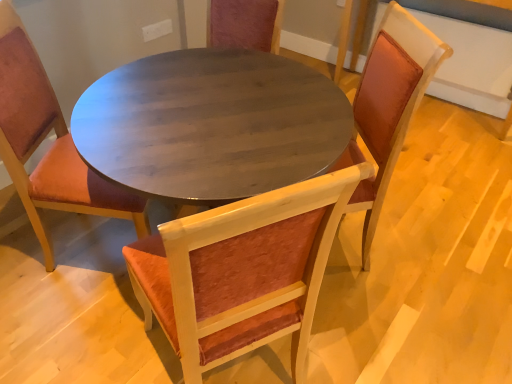
Question: Can you confirm if velvet orange chair at center, placed as the 3th chair when sorted from right to left, is thinner than velvet orange chair at center, which is counted as the 3th chair, starting from the left?

Choices:
 (A) no
 (B) yes

Answer: (B)

Question: Can velvet orange chair at center, which ranks as the first chair in right-to-left order, be found inside velvet orange chair at center, placed as the 3th chair when sorted from right to left?

Choices:
 (A) no
 (B) yes

Answer: (A)

Question: Is velvet orange chair at center, which ranks as the first chair in left-to-right order, oriented away from velvet orange chair at center, which is counted as the 3th chair, starting from the left?

Choices:
 (A) no
 (B) yes

Answer: (A)

Question: Considering the relative positions of velvet orange chair at center, which ranks as the first chair in left-to-right order, and velvet orange chair at center, which is counted as the 3th chair, starting from the left, in the image provided, is velvet orange chair at center, which ranks as the first chair in left-to-right order, to the left of velvet orange chair at center, which is counted as the 3th chair, starting from the left, from the viewer's perspective?

Choices:
 (A) no
 (B) yes

Answer: (B)

Question: Is the depth of velvet orange chair at center, placed as the 3th chair when sorted from right to left, greater than that of velvet orange chair at center, which is counted as the 3th chair, starting from the left?

Choices:
 (A) no
 (B) yes

Answer: (B)

Question: Is velvet orange chair at center, which ranks as the first chair in left-to-right order, facing towards velvet orange chair at center, which ranks as the first chair in right-to-left order?

Choices:
 (A) no
 (B) yes

Answer: (B)

Question: From a real-world perspective, is velvet orange chair at center, which ranks as the first chair in right-to-left order, positioned over velvet orange chair at center, the 2th chair viewed from the right, based on gravity?

Choices:
 (A) no
 (B) yes

Answer: (B)

Question: Would you say velvet orange chair at center, which ranks as the first chair in right-to-left order, contains velvet orange chair at center, the 2th chair viewed from the right?

Choices:
 (A) no
 (B) yes

Answer: (A)

Question: Is velvet orange chair at center, which ranks as the first chair in right-to-left order, placed right next to velvet orange chair at center, the 2th chair viewed from the right?

Choices:
 (A) yes
 (B) no

Answer: (B)

Question: Is velvet orange chair at center, which is counted as the 3th chair, starting from the left, positioned beyond the bounds of velvet orange chair at center, which is the second chair from left to right?

Choices:
 (A) yes
 (B) no

Answer: (A)

Question: Is velvet orange chair at center, which ranks as the first chair in right-to-left order, bigger than velvet orange chair at center, which is the second chair from left to right?

Choices:
 (A) no
 (B) yes

Answer: (B)

Question: Considering the relative sizes of velvet orange chair at center, which is counted as the 3th chair, starting from the left, and velvet orange chair at center, the 2th chair viewed from the right, in the image provided, is velvet orange chair at center, which is counted as the 3th chair, starting from the left, taller than velvet orange chair at center, the 2th chair viewed from the right,?

Choices:
 (A) no
 (B) yes

Answer: (B)

Question: Is there a large distance between velvet orange chair at center, placed as the 3th chair when sorted from right to left, and velvet orange chair at center, which is the second chair from left to right?

Choices:
 (A) yes
 (B) no

Answer: (B)